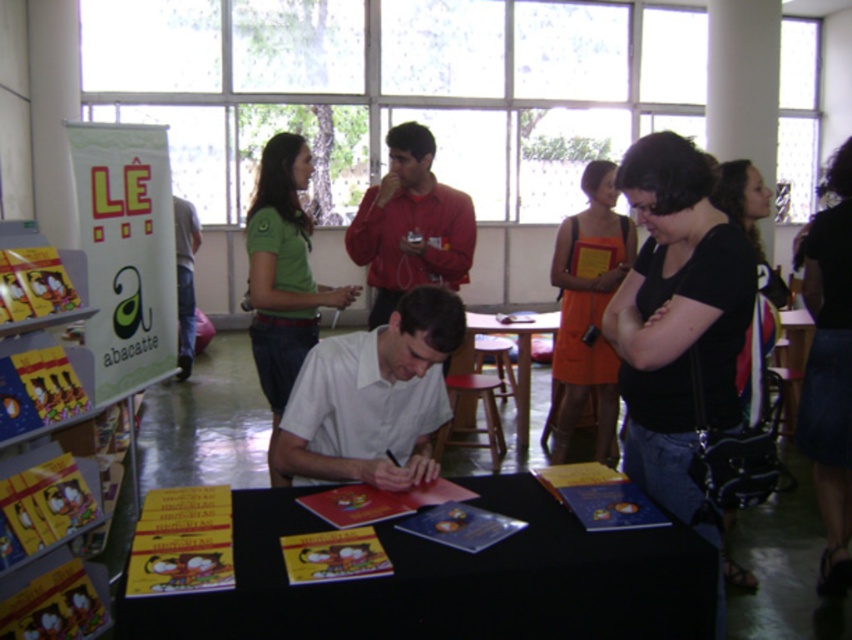
Question: Which object appears farthest from the camera in this image?

Choices:
 (A) black matte shirt at center
 (B) green matte shirt at upper left
 (C) matte red shirt at center

Answer: (C)

Question: Can you confirm if white matte shirt at center is positioned to the right of jeans at left?

Choices:
 (A) yes
 (B) no

Answer: (A)

Question: Which of the following is the closest to the observer?

Choices:
 (A) matte red shirt at center
 (B) green matte shirt at upper left

Answer: (B)

Question: Is black matte shirt at center positioned before orange fabric dress at center?

Choices:
 (A) yes
 (B) no

Answer: (A)

Question: Is white matte shirt at center smaller than black fabric dress at lower right?

Choices:
 (A) yes
 (B) no

Answer: (A)

Question: Among these objects, which one is farthest from the camera?

Choices:
 (A) black fabric dress at lower right
 (B) white matte shirt at center
 (C) orange fabric dress at center
 (D) matte red shirt at center

Answer: (C)